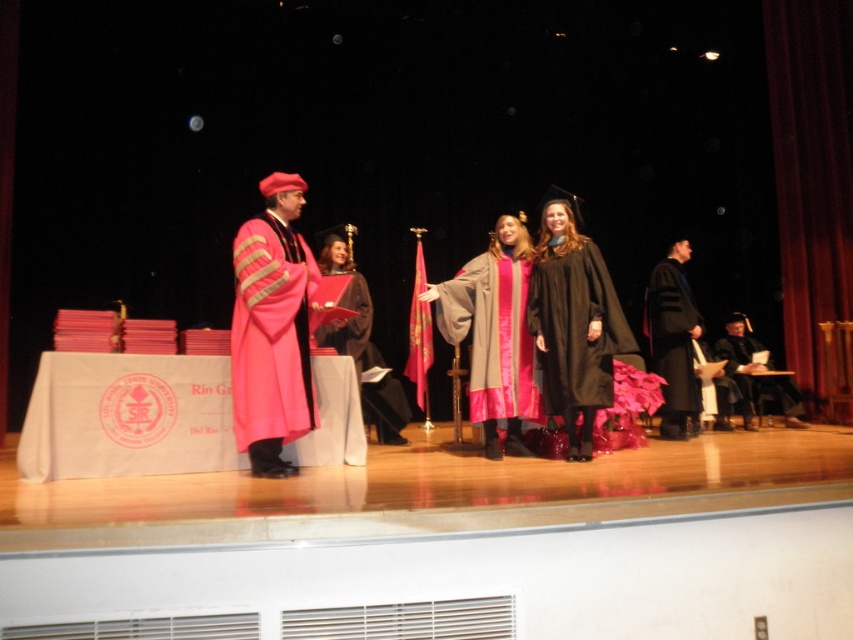
Is matte gray gown with pink accents at center closer to camera compared to matte black robe at lower right?

Yes.

Between point (483, 257) and point (762, 352), which one is positioned behind?

The point (762, 352) is more distant.

Find the location of `matte gray gown with pink accents at center`. matte gray gown with pink accents at center is located at coordinates (492, 333).

Can you confirm if matte gray gown with pink accents at center is positioned to the right of matte pink gown at center?

Correct, you'll find matte gray gown with pink accents at center to the right of matte pink gown at center.

Who is more forward, (457,275) or (358,273)?

Positioned in front is point (457,275).

What are the coordinates of `matte gray gown with pink accents at center` in the screenshot? It's located at (492, 333).

Can you confirm if black matte gown at center is smaller than matte black robe at lower right?

Correct, black matte gown at center occupies less space than matte black robe at lower right.

Between black matte gown at center and matte black robe at lower right, which one has less height?

Standing shorter between the two is matte black robe at lower right.

The width and height of the screenshot is (853, 640). Identify the location of black matte gown at center. (575, 324).